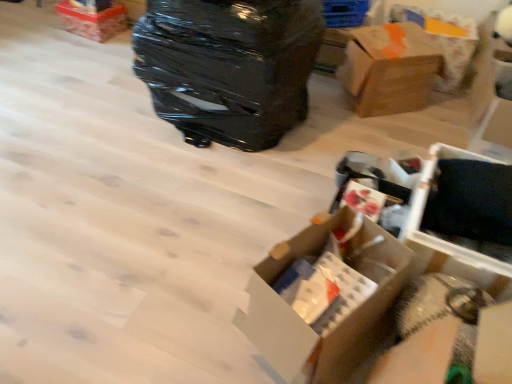
This screenshot has width=512, height=384. What are the coordinates of `vacant area that is in front of black plastic suitcase at upper center` in the screenshot? It's located at (194, 190).